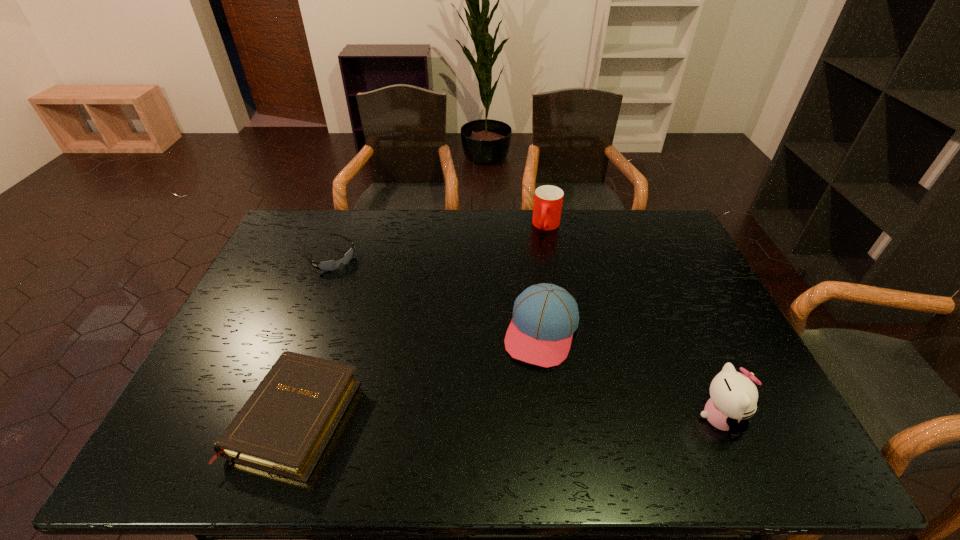
Identify the location of the second shortest object. Image resolution: width=960 pixels, height=540 pixels. (283, 428).

Locate an element on the screen. the rightmost object is located at coordinates pyautogui.click(x=734, y=397).

Where is `kitten`? This screenshot has width=960, height=540. kitten is located at coordinates (734, 397).

Image resolution: width=960 pixels, height=540 pixels. What are the coordinates of `the shortest object` in the screenshot? It's located at (330, 265).

What are the coordinates of `the second farthest object` in the screenshot? It's located at tap(330, 265).

Locate an element on the screen. This screenshot has height=540, width=960. cup is located at coordinates (548, 200).

At what (x,y) coordinates should I click in order to perform the action: click on baseball cap. Please return your answer as a coordinate pair (x, y). This screenshot has width=960, height=540. Looking at the image, I should click on point(545,316).

This screenshot has height=540, width=960. In order to click on free location located 0.290m on the right of the fourth tallest object in this screenshot , I will do `click(473, 417)`.

Where is `blank space located on the front-facing side of the kitten`? blank space located on the front-facing side of the kitten is located at coordinates (775, 418).

Locate an element on the screen. The width and height of the screenshot is (960, 540). free space located on the lenses of the sunglasses is located at coordinates (401, 323).